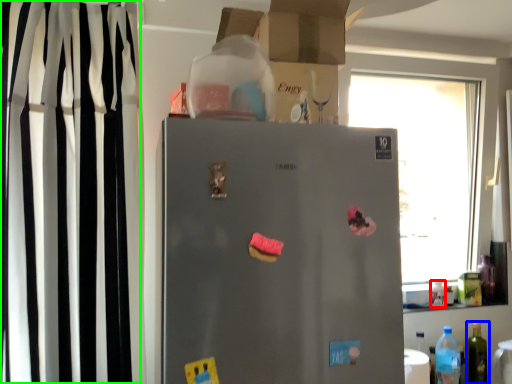
Question: Which object is positioned closest to bottle (highlighted by a red box)? Select from bottle (highlighted by a blue box) and curtain (highlighted by a green box).

Choices:
 (A) bottle
 (B) curtain

Answer: (A)